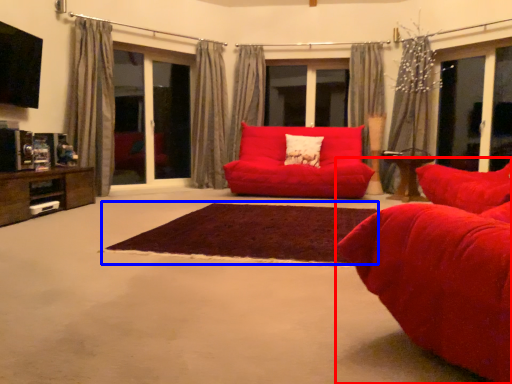
Question: Which of the following is the closest to the observer, studio couch (highlighted by a red box) or plain (highlighted by a blue box)?

Choices:
 (A) studio couch
 (B) plain

Answer: (A)